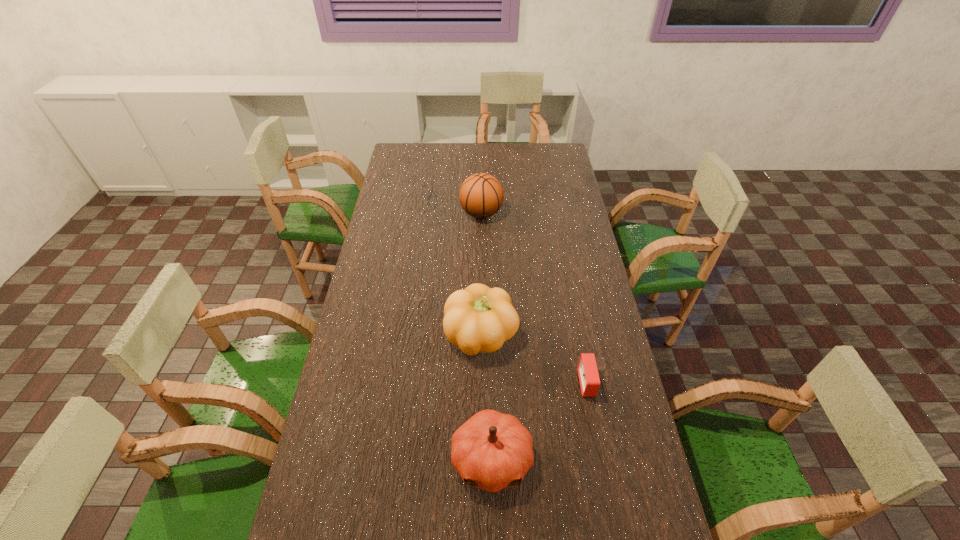
Identify the location of the farther pumpkin. This screenshot has height=540, width=960. (477, 319).

Where is `basketball`? The height and width of the screenshot is (540, 960). basketball is located at coordinates (481, 195).

Identify the location of the nearer pumpkin. This screenshot has width=960, height=540. (492, 450).

At what (x,y) coordinates should I click in order to perform the action: click on the rightmost object. Please return your answer as a coordinate pair (x, y). The image size is (960, 540). Looking at the image, I should click on (587, 368).

At what (x,y) coordinates should I click in order to perform the action: click on the third farthest object. Please return your answer as a coordinate pair (x, y). The image size is (960, 540). Looking at the image, I should click on (587, 368).

Locate an element on the screen. The width and height of the screenshot is (960, 540). free space located 0.370m on the back of the second farthest object is located at coordinates (481, 235).

The width and height of the screenshot is (960, 540). Identify the location of vacant space located 0.090m on the front of the basketball. (482, 241).

At what (x,y) coordinates should I click in order to perform the action: click on vacant region located on the front-facing side of the nearest object. Please return your answer as a coordinate pair (x, y). The height and width of the screenshot is (540, 960). Looking at the image, I should click on (493, 532).

At what (x,y) coordinates should I click in order to perform the action: click on vacant space located 0.250m on the front-facing side of the alarm clock. Please return your answer as a coordinate pair (x, y). This screenshot has height=540, width=960. Looking at the image, I should click on (495, 383).

Find the location of a particular element. free space located 0.300m on the front-facing side of the alarm clock is located at coordinates (479, 383).